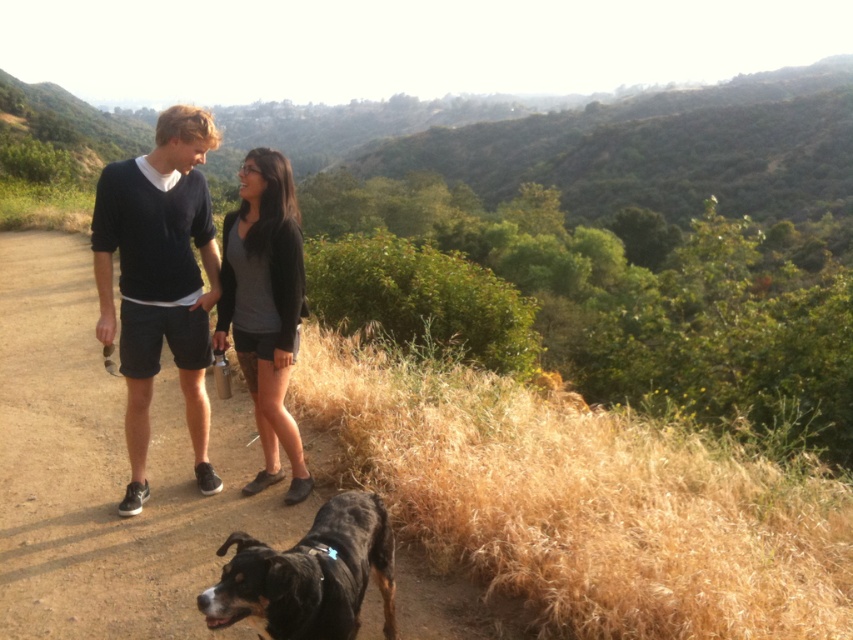
Does point (198, 305) come behind point (234, 592)?

Yes, it is.

Is black cotton shorts at center bigger than black fur dog at lower left?

No.

Where is `black cotton shorts at center`? black cotton shorts at center is located at coordinates (160, 280).

You are a GUI agent. You are given a task and a screenshot of the screen. Output one action in this format:
    pyautogui.click(x=<x>, y=<y>)
    Task: Click on the black cotton shorts at center
    The image size is (853, 640).
    Given the screenshot: What is the action you would take?
    pyautogui.click(x=160, y=280)

Based on the photo, measure the distance from black cotton shorts at center to gray matte/black shorts at center.

The distance of black cotton shorts at center from gray matte/black shorts at center is 3.55 feet.

Who is more distant from viewer, (x=143, y=490) or (x=283, y=243)?

Point (x=143, y=490)

Is point (138, 460) more distant than point (279, 241)?

Yes.

The height and width of the screenshot is (640, 853). Identify the location of black cotton shorts at center. tap(160, 280).

Which of these two, gray matte/black shorts at center or black fur dog at lower left, stands taller?

gray matte/black shorts at center is taller.

Does point (286, 202) come closer to viewer compared to point (248, 563)?

No, (286, 202) is further to viewer.

This screenshot has width=853, height=640. In order to click on gray matte/black shorts at center in this screenshot , I will do `click(265, 307)`.